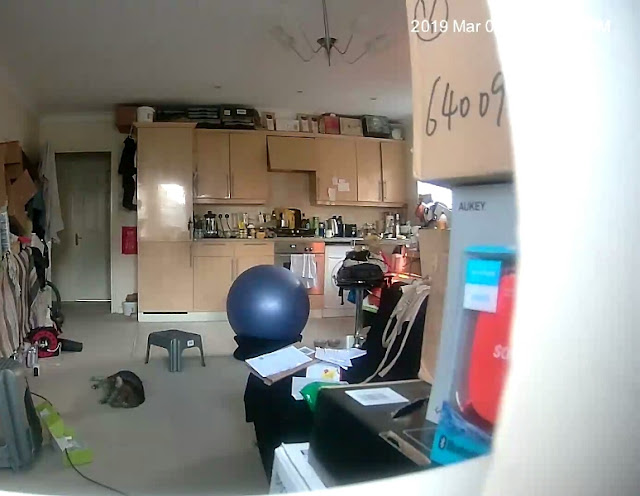
The height and width of the screenshot is (496, 640). I want to click on white ceiling empty space, so click(x=52, y=60), click(x=148, y=54), click(x=246, y=47), click(x=396, y=67).